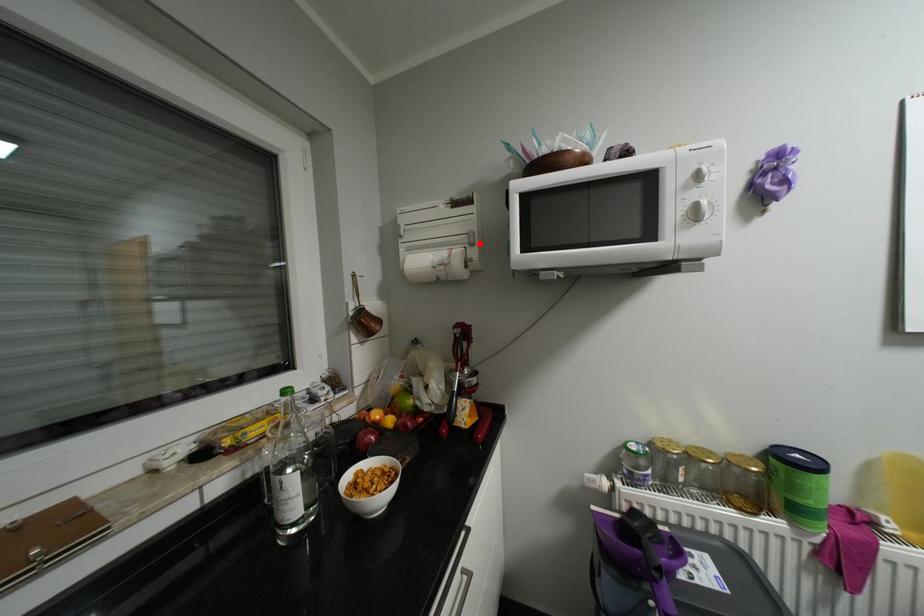
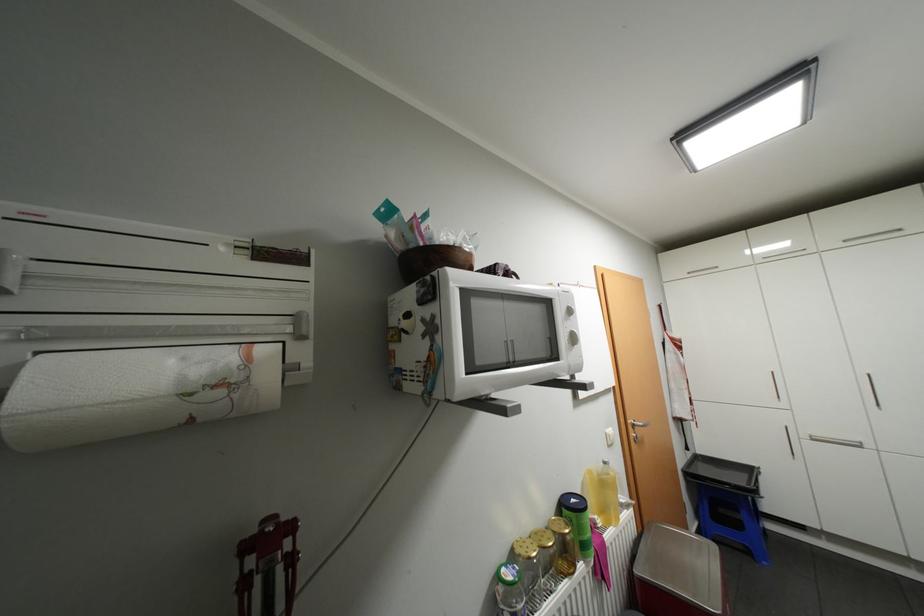
The point at the highlighted location is marked in the first image. Where is the corresponding point in the second image?

(309, 336)